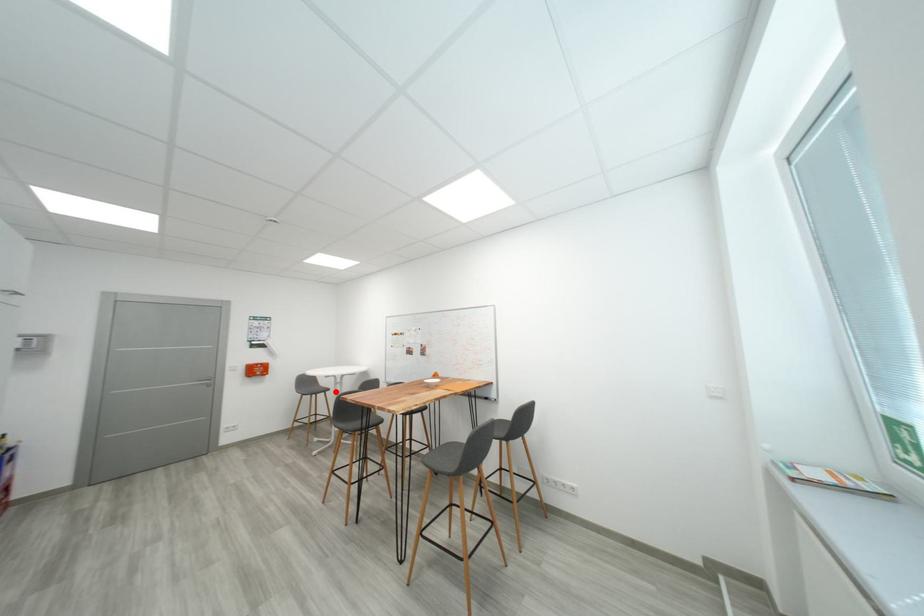
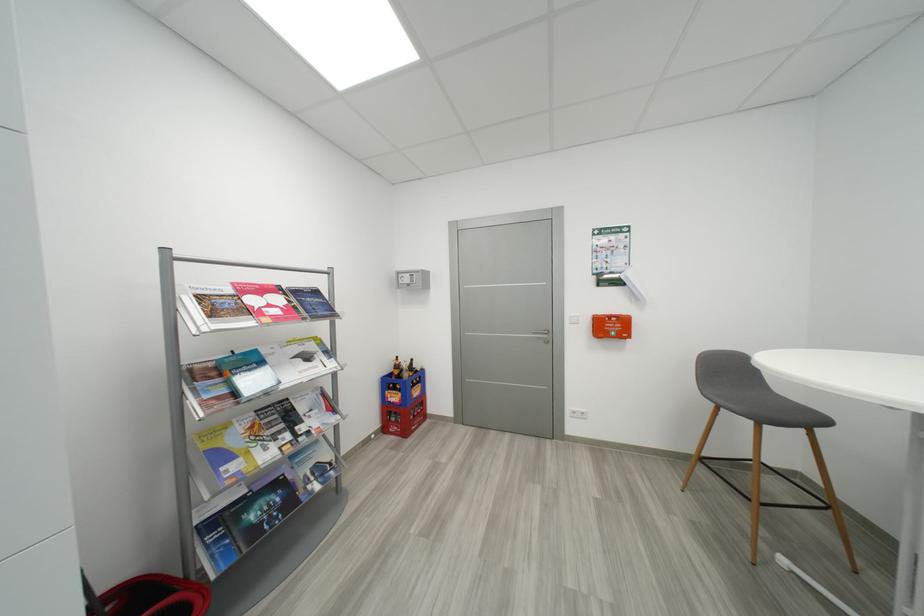
Question: I am providing you with two images of the same scene from different viewpoints. Image1 has a red point marked. In image2, the corresponding 3D location appears at what relative position? Reply with the corresponding letter.

Choices:
 (A) Closer
 (B) Farther

Answer: (A)